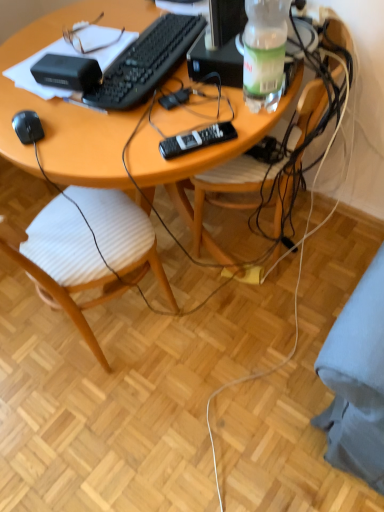
Locate an element on the screen. This screenshot has height=512, width=384. free space in front of black matte keyboard at center is located at coordinates (153, 121).